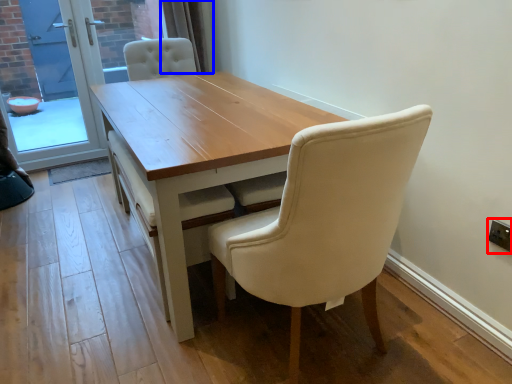
Question: Among these objects, which one is farthest to the camera, electric outlet (highlighted by a red box) or curtain (highlighted by a blue box)?

Choices:
 (A) electric outlet
 (B) curtain

Answer: (B)